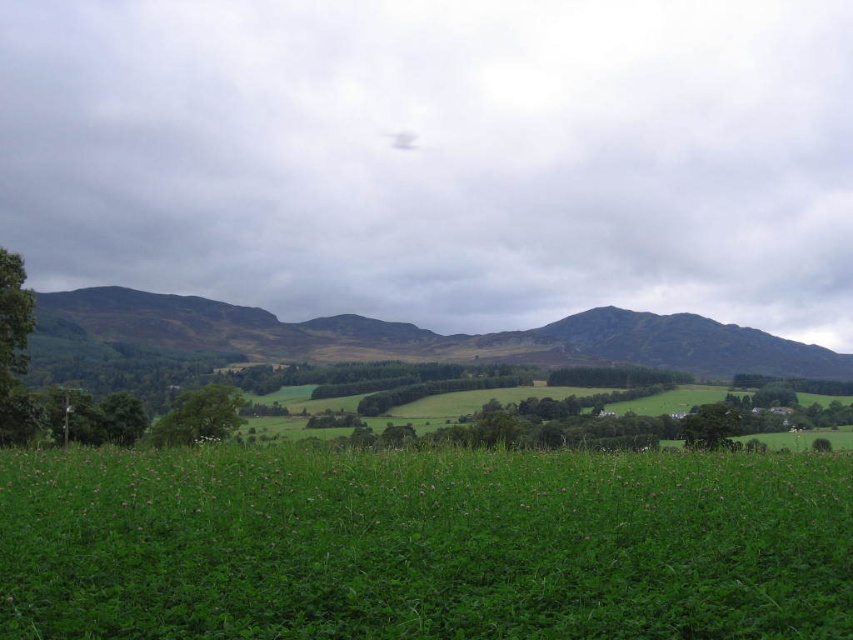
Is white fluffy cloud at upper center wider than rugged brown mountain at center?

Correct, the width of white fluffy cloud at upper center exceeds that of rugged brown mountain at center.

Can you confirm if white fluffy cloud at upper center is thinner than rugged brown mountain at center?

No, white fluffy cloud at upper center is not thinner than rugged brown mountain at center.

Is point (169, 257) closer to camera compared to point (822, 362)?

No, it is not.

Locate an element on the screen. white fluffy cloud at upper center is located at coordinates (438, 156).

Which is more to the left, white fluffy cloud at upper center or green grassy field at center?

white fluffy cloud at upper center

Can you confirm if white fluffy cloud at upper center is smaller than green grassy field at center?

No, white fluffy cloud at upper center is not smaller than green grassy field at center.

Between point (312, 74) and point (734, 465), which one is positioned in front?

Point (734, 465)

You are a GUI agent. You are given a task and a screenshot of the screen. Output one action in this format:
    pyautogui.click(x=<x>, y=<y>)
    Task: Click on the white fluffy cloud at upper center
    
    Given the screenshot: What is the action you would take?
    pyautogui.click(x=438, y=156)

Is green grassy field at center positioned before rugged brown mountain at center?

Yes.

Between green grassy field at center and rugged brown mountain at center, which one is positioned lower?

green grassy field at center

Is point (276, 618) closer to viewer compared to point (305, 355)?

Yes, it is.

Locate an element on the screen. green grassy field at center is located at coordinates [422, 545].